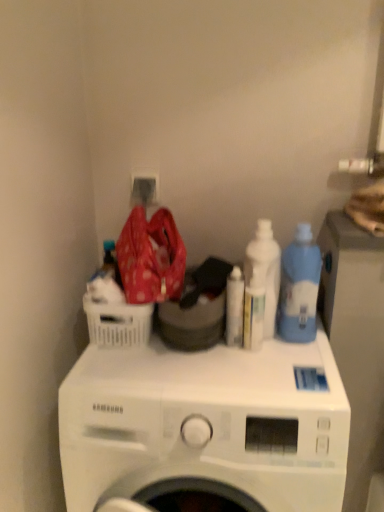
Identify the location of free space in front of white glossy bottle at center, the 1th cleaning product when ordered from left to right. This screenshot has width=384, height=512. (241, 383).